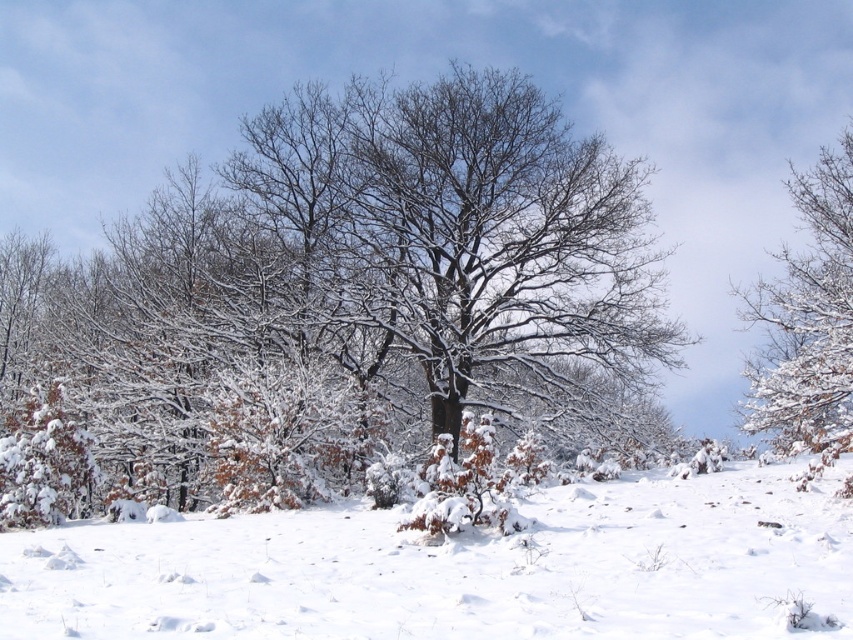
Question: Which point is closer to the camera?

Choices:
 (A) white snow-covered tree at right
 (B) white fluffy snow at center

Answer: (B)

Question: Can you confirm if white fluffy snow at center is thinner than white snow-covered tree at right?

Choices:
 (A) no
 (B) yes

Answer: (A)

Question: Is white fluffy snow at center bigger than white snow-covered tree at right?

Choices:
 (A) no
 (B) yes

Answer: (A)

Question: Considering the relative positions of white fluffy snow at center and white snow-covered tree at right in the image provided, where is white fluffy snow at center located with respect to white snow-covered tree at right?

Choices:
 (A) right
 (B) left

Answer: (B)

Question: Among these points, which one is nearest to the camera?

Choices:
 (A) (844, 198)
 (B) (207, 564)

Answer: (B)